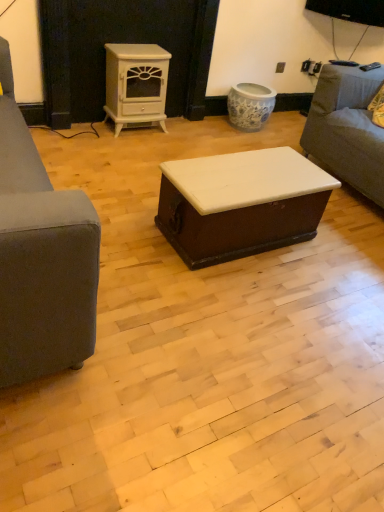
Find the location of `free spot in front of white glossy trunk at center`. free spot in front of white glossy trunk at center is located at coordinates (246, 309).